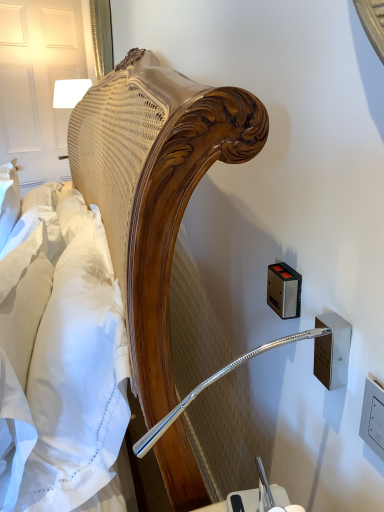
Question: Does white cotton sheet at left lie behind metallic silver outlet at right, marked as the second electric outlet in a left-to-right arrangement?

Choices:
 (A) no
 (B) yes

Answer: (A)

Question: Is white cotton sheet at left bigger than metallic silver outlet at right, which is the 2th electric outlet from back to front?

Choices:
 (A) no
 (B) yes

Answer: (B)

Question: Can you confirm if white cotton sheet at left is smaller than metallic silver outlet at right, which is the 2th electric outlet from back to front?

Choices:
 (A) no
 (B) yes

Answer: (A)

Question: From a real-world perspective, does white cotton sheet at left stand above metallic silver outlet at right, the first electric outlet positioned from the front?

Choices:
 (A) no
 (B) yes

Answer: (A)

Question: Can you confirm if white cotton sheet at left is taller than metallic silver outlet at right, which is the 2th electric outlet from back to front?

Choices:
 (A) yes
 (B) no

Answer: (A)

Question: Is white cotton sheet at left not within metallic silver outlet at right, the first electric outlet positioned from the front?

Choices:
 (A) no
 (B) yes

Answer: (B)

Question: Considering the relative positions of wooden bedside lamp at upper left and metallic rectangular at right, arranged as the first electric outlet when viewed from the back, in the image provided, is wooden bedside lamp at upper left behind metallic rectangular at right, arranged as the first electric outlet when viewed from the back,?

Choices:
 (A) no
 (B) yes

Answer: (B)

Question: Is wooden bedside lamp at upper left touching metallic rectangular at right, arranged as the first electric outlet when viewed from the back?

Choices:
 (A) no
 (B) yes

Answer: (A)

Question: Considering the relative positions of wooden bedside lamp at upper left and metallic rectangular at right, arranged as the 1th electric outlet when viewed from the left, in the image provided, is wooden bedside lamp at upper left to the right of metallic rectangular at right, arranged as the 1th electric outlet when viewed from the left, from the viewer's perspective?

Choices:
 (A) no
 (B) yes

Answer: (A)

Question: From a real-world perspective, is wooden bedside lamp at upper left beneath metallic rectangular at right, arranged as the first electric outlet when viewed from the back?

Choices:
 (A) no
 (B) yes

Answer: (A)

Question: From the image's perspective, is wooden bedside lamp at upper left below metallic rectangular at right, arranged as the 1th electric outlet when viewed from the left?

Choices:
 (A) no
 (B) yes

Answer: (A)

Question: From a real-world perspective, is wooden bedside lamp at upper left physically above metallic rectangular at right, the 2th electric outlet from the right?

Choices:
 (A) yes
 (B) no

Answer: (A)

Question: Does metallic silver outlet at right, which is the 2th electric outlet from back to front, lie behind metallic rectangular at right, marked as the 2th electric outlet in a front-to-back arrangement?

Choices:
 (A) yes
 (B) no

Answer: (B)